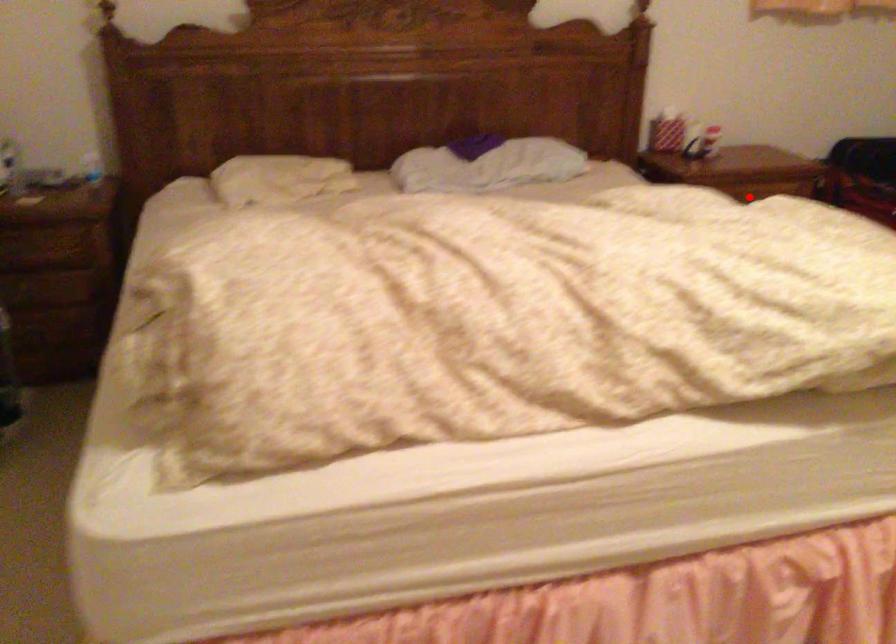
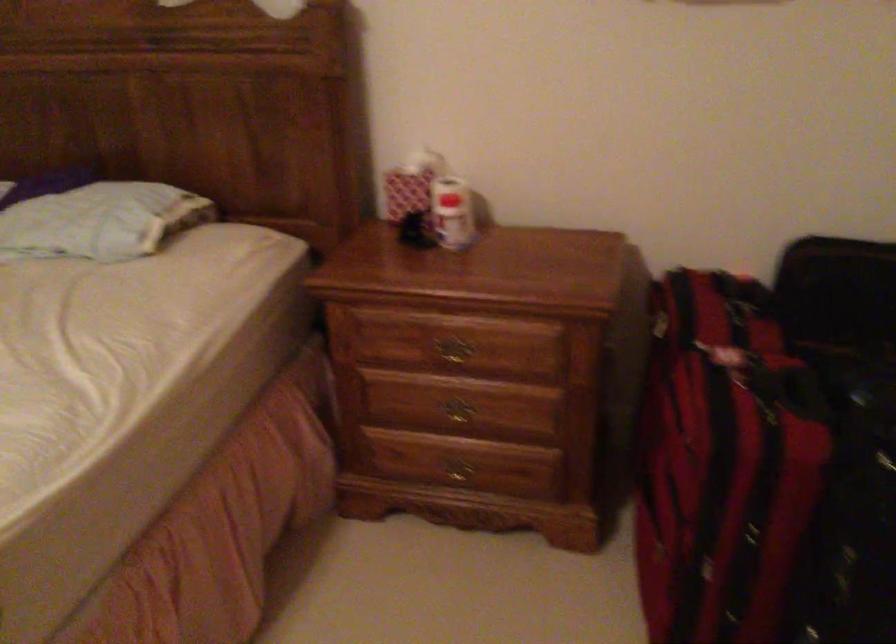
Question: I am providing you with two images of the same scene from different viewpoints. Image1 has a red point marked. In image2, the corresponding 3D location appears at what relative position? Reply with the corresponding letter.

Choices:
 (A) Closer
 (B) Farther

Answer: (A)